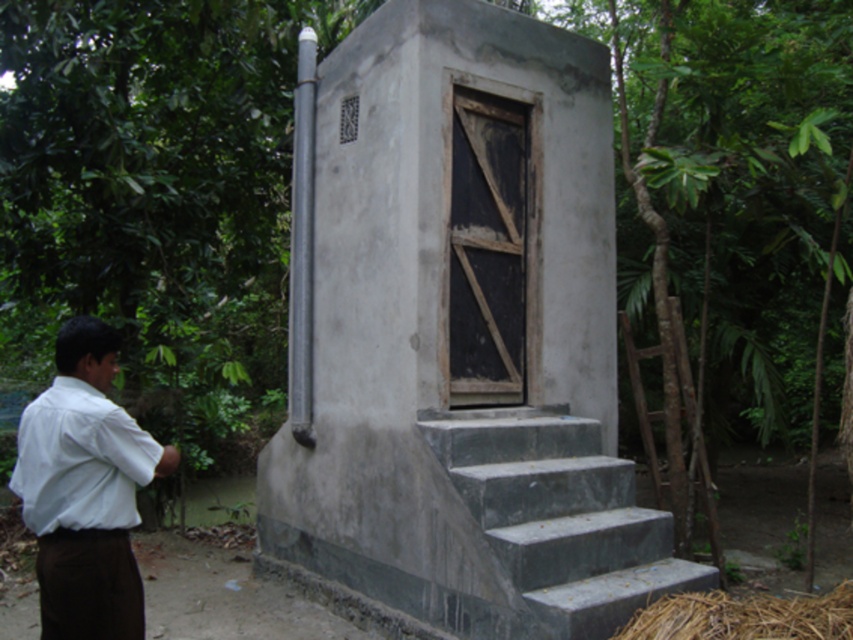
Does white shirt at left have a greater width compared to white matte dress shirt at left?

Indeed, white shirt at left has a greater width compared to white matte dress shirt at left.

Who is more distant from viewer, (73,400) or (33,403)?

The point (33,403) is behind.

Find the location of `white shirt at left`. white shirt at left is located at coordinates (85, 490).

Does point (363, 32) come in front of point (42, 536)?

No.

Describe the element at coordinates (462, 339) in the screenshot. I see `gray concrete hut at center` at that location.

Find the location of a particular element. This screenshot has width=853, height=640. gray concrete hut at center is located at coordinates (462, 339).

From the picture: Which is above, gray concrete stairs at center or white matte dress shirt at left?

Positioned higher is white matte dress shirt at left.

Who is taller, gray concrete stairs at center or white matte dress shirt at left?

With more height is gray concrete stairs at center.

Does point (496, 508) come farther from viewer compared to point (77, 390)?

Yes, point (496, 508) is behind point (77, 390).

Where is `gray concrete stairs at center`? gray concrete stairs at center is located at coordinates (560, 516).